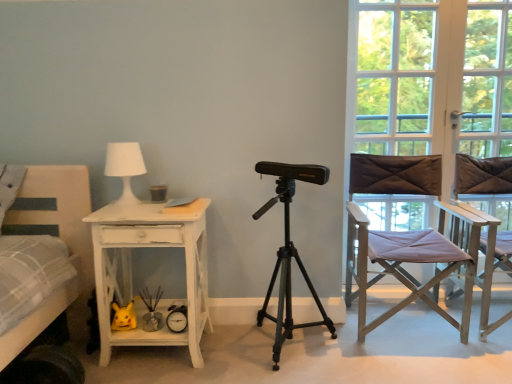
Find the location of `clear glass window at right`. clear glass window at right is located at coordinates (395, 76).

The image size is (512, 384). Describe the element at coordinates (125, 167) in the screenshot. I see `white matte table lamp at upper left` at that location.

Locate an element on the screen. The image size is (512, 384). light brown fabric director's chair at right, the first chair from the left is located at coordinates (404, 237).

The width and height of the screenshot is (512, 384). In order to click on white distressed wood desk at left in this screenshot , I will do `click(131, 270)`.

The width and height of the screenshot is (512, 384). What do you see at coordinates (482, 176) in the screenshot? I see `light brown wooden chair at right, which ranks as the 1th chair in right-to-left order` at bounding box center [482, 176].

What is the approximate width of metallic tripod at center?

→ 16.57 inches.

Where is `clear glass window at right`? clear glass window at right is located at coordinates (395, 76).

Is point (409, 172) closer to camera compared to point (120, 174)?

No, (409, 172) is behind (120, 174).

Is light brown fabric director's chair at right, the first chair from the left, to the left or to the right of white matte table lamp at upper left in the image?

Based on their positions, light brown fabric director's chair at right, the first chair from the left, is located to the right of white matte table lamp at upper left.

Based on the photo, from the image's perspective, who appears lower, light brown fabric director's chair at right, which is the second chair in right-to-left order, or white matte table lamp at upper left?

light brown fabric director's chair at right, which is the second chair in right-to-left order.

From a real-world perspective, is light brown fabric director's chair at right, which is the second chair in right-to-left order, above or below white matte table lamp at upper left?

In terms of real-world spatial position, light brown fabric director's chair at right, which is the second chair in right-to-left order, is below white matte table lamp at upper left.

Can you see white matte table lamp at upper left touching clear glass window at right?

No.

From a real-world perspective, is white matte table lamp at upper left positioned above or below clear glass window at right?

white matte table lamp at upper left is situated lower than clear glass window at right in the real world.

Would you say clear glass window at right is part of white matte table lamp at upper left's contents?

No, clear glass window at right is not surrounded by white matte table lamp at upper left.

Is white distressed wood desk at left turned away from light brown wooden chair at right, which ranks as the 1th chair in right-to-left order?

No, light brown wooden chair at right, which ranks as the 1th chair in right-to-left order, is not at the back of white distressed wood desk at left.

Is white distressed wood desk at left to the left of light brown wooden chair at right, the second chair viewed from the left, from the viewer's perspective?

Yes, white distressed wood desk at left is to the left of light brown wooden chair at right, the second chair viewed from the left.

Which of these two, white distressed wood desk at left or light brown wooden chair at right, the second chair viewed from the left, stands taller?

light brown wooden chair at right, the second chair viewed from the left.

Which of these two, light brown wooden chair at right, the second chair viewed from the left, or metallic tripod at center, is wider?

light brown wooden chair at right, the second chair viewed from the left.

From a real-world perspective, between light brown wooden chair at right, the second chair viewed from the left, and metallic tripod at center, who is vertically lower?

From a 3D spatial view, light brown wooden chair at right, the second chair viewed from the left, is below.

Does light brown wooden chair at right, the second chair viewed from the left, have a greater height compared to metallic tripod at center?

Correct, light brown wooden chair at right, the second chair viewed from the left, is much taller as metallic tripod at center.

Which object is positioned more to the left, light brown wooden chair at right, which ranks as the 1th chair in right-to-left order, or metallic tripod at center?

metallic tripod at center.

Find the location of `window behind the white glass window frame at right`. window behind the white glass window frame at right is located at coordinates (395, 76).

Is white glass window frame at right not inside clear glass window at right?

Yes, white glass window frame at right is outside of clear glass window at right.

Is there a large distance between white glass window frame at right and clear glass window at right?

white glass window frame at right is near clear glass window at right, not far away.

What's the angular difference between white glass window frame at right and clear glass window at right's facing directions?

0.237 degrees separate the facing orientations of white glass window frame at right and clear glass window at right.

Considering the relative positions of metallic tripod at center and light brown wooden chair at right, the second chair viewed from the left, in the image provided, is metallic tripod at center to the left of light brown wooden chair at right, the second chair viewed from the left, from the viewer's perspective?

Correct, you'll find metallic tripod at center to the left of light brown wooden chair at right, the second chair viewed from the left.

Is metallic tripod at center behind light brown wooden chair at right, the second chair viewed from the left?

No, metallic tripod at center is closer to the viewer.

Can light brown wooden chair at right, which ranks as the 1th chair in right-to-left order, be found inside metallic tripod at center?

Definitely not — light brown wooden chair at right, which ranks as the 1th chair in right-to-left order, is not inside metallic tripod at center.

In terms of height, does metallic tripod at center look taller or shorter compared to light brown wooden chair at right, which ranks as the 1th chair in right-to-left order?

Considering their sizes, metallic tripod at center has less height than light brown wooden chair at right, which ranks as the 1th chair in right-to-left order.

Is clear glass window at right bigger or smaller than white matte table lamp at upper left?

Considering their sizes, clear glass window at right takes up more space than white matte table lamp at upper left.

How many degrees apart are the facing directions of clear glass window at right and white matte table lamp at upper left?

There is a 0.0716-degree angle between the facing directions of clear glass window at right and white matte table lamp at upper left.

Choose the correct answer: Is clear glass window at right inside white matte table lamp at upper left or outside it?

clear glass window at right is not inside white matte table lamp at upper left, it's outside.

Image resolution: width=512 pixels, height=384 pixels. What are the coordinates of `table lamp behind the light brown fabric director's chair at right, the first chair from the left` in the screenshot? It's located at (125, 167).

Locate an element on the screen. Image resolution: width=512 pixels, height=384 pixels. table lamp in front of the clear glass window at right is located at coordinates (125, 167).

When comparing their distances from white matte table lamp at upper left, does metallic tripod at center or white glass window frame at right seem further?

white glass window frame at right is positioned further to the anchor white matte table lamp at upper left.

When comparing their distances from metallic tripod at center, does white matte table lamp at upper left or light brown fabric director's chair at right, the first chair from the left, seem closer?

The object closer to metallic tripod at center is light brown fabric director's chair at right, the first chair from the left.

When comparing their distances from light brown wooden chair at right, the second chair viewed from the left, does white matte table lamp at upper left or white glass window frame at right seem further?

white matte table lamp at upper left is positioned further to the anchor light brown wooden chair at right, the second chair viewed from the left.

Looking at the image, which one is located further to light brown fabric director's chair at right, which is the second chair in right-to-left order, white matte table lamp at upper left or clear glass window at right?

white matte table lamp at upper left is positioned further to the anchor light brown fabric director's chair at right, which is the second chair in right-to-left order.

Based on the photo, estimate the real-world distances between objects in this image. Which object is further from light brown wooden chair at right, which ranks as the 1th chair in right-to-left order, white distressed wood desk at left or metallic tripod at center?

white distressed wood desk at left is further to light brown wooden chair at right, which ranks as the 1th chair in right-to-left order.

Looking at the image, which one is located further to white distressed wood desk at left, light brown fabric director's chair at right, the first chair from the left, or light brown wooden chair at right, which ranks as the 1th chair in right-to-left order?

The object further to white distressed wood desk at left is light brown wooden chair at right, which ranks as the 1th chair in right-to-left order.

Considering their positions, is light brown wooden chair at right, the second chair viewed from the left, positioned further to white matte table lamp at upper left than clear glass window at right?

light brown wooden chair at right, the second chair viewed from the left, is further to white matte table lamp at upper left.

Looking at the image, which one is located further to light brown wooden chair at right, the second chair viewed from the left, metallic tripod at center or clear glass window at right?

metallic tripod at center is further to light brown wooden chair at right, the second chair viewed from the left.

Identify the location of chair between white distressed wood desk at left and white glass window frame at right from left to right. Image resolution: width=512 pixels, height=384 pixels. (404, 237).

Image resolution: width=512 pixels, height=384 pixels. I want to click on desk located between white matte table lamp at upper left and light brown wooden chair at right, the second chair viewed from the left, in the left-right direction, so click(x=131, y=270).

Identify the location of chair located between white distressed wood desk at left and clear glass window at right in the left-right direction. The image size is (512, 384). (404, 237).

Image resolution: width=512 pixels, height=384 pixels. Find the location of `window between metallic tripod at center and light brown wooden chair at right, which ranks as the 1th chair in right-to-left order`. window between metallic tripod at center and light brown wooden chair at right, which ranks as the 1th chair in right-to-left order is located at coordinates (395, 76).